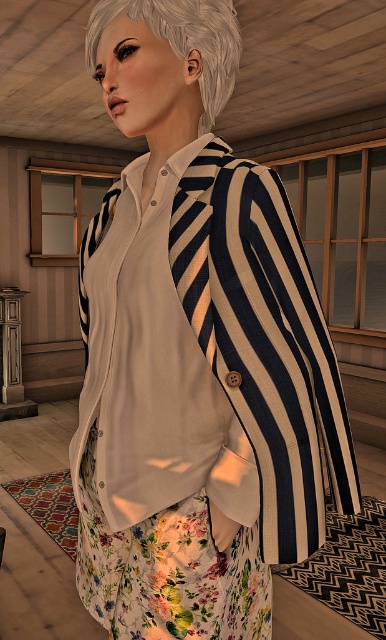
Question: Among these objects, which one is farthest from the camera?

Choices:
 (A) striped fabric tie at center
 (B) white matte tie at center

Answer: (B)

Question: Among these objects, which one is farthest from the camera?

Choices:
 (A) striped fabric tie at center
 (B) white matte hair at upper center
 (C) white matte tie at center

Answer: (C)

Question: Among these points, which one is nearest to the camera?

Choices:
 (A) (79, 272)
 (B) (89, 19)
 (C) (184, 234)

Answer: (C)

Question: Is striped fabric tie at center above white matte tie at center?

Choices:
 (A) yes
 (B) no

Answer: (B)

Question: Does white matte hair at upper center appear on the left side of white matte tie at center?

Choices:
 (A) no
 (B) yes

Answer: (A)

Question: Can you confirm if striped fabric tie at center is positioned to the right of white matte tie at center?

Choices:
 (A) yes
 (B) no

Answer: (A)